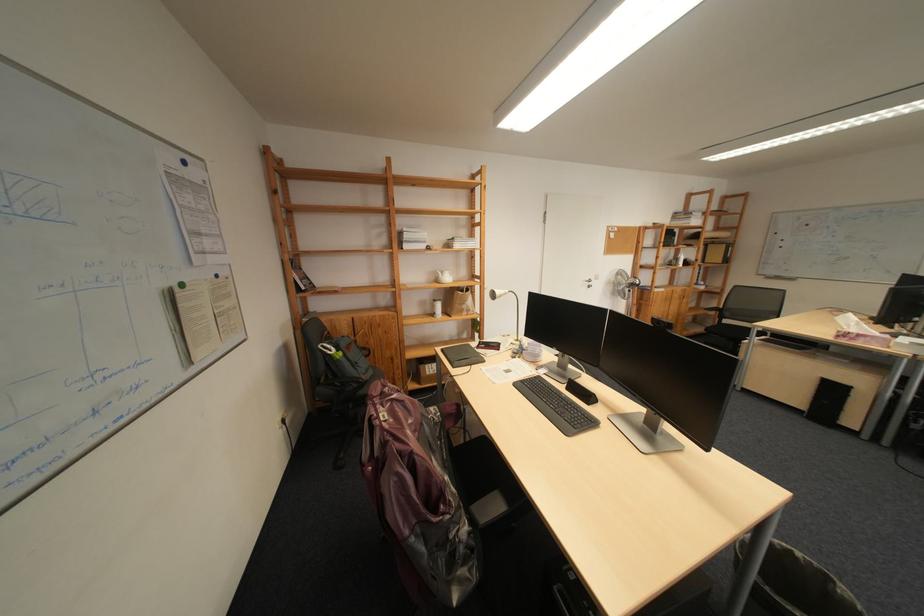
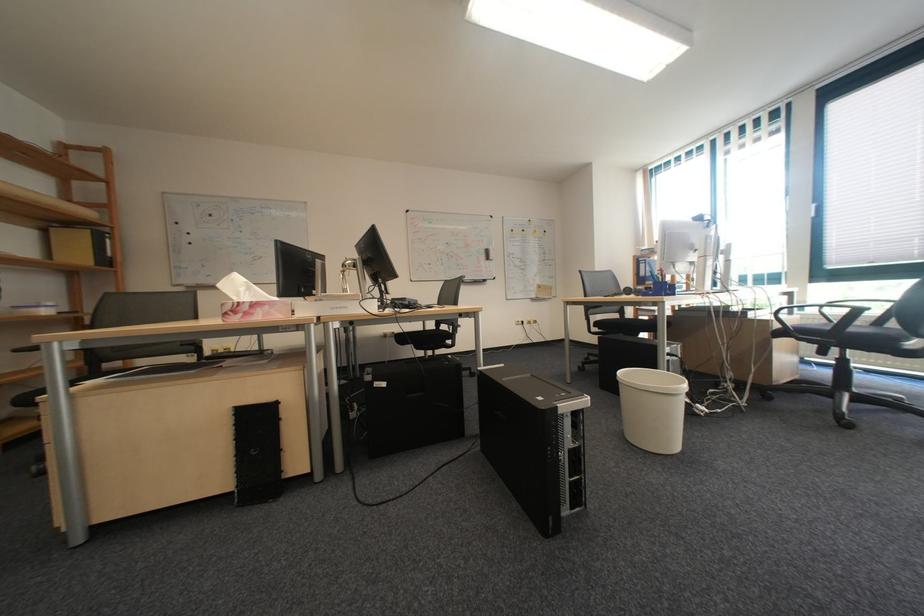
Locate, in the second image, the point that corresponds to [877,339] in the first image.

(273, 312)